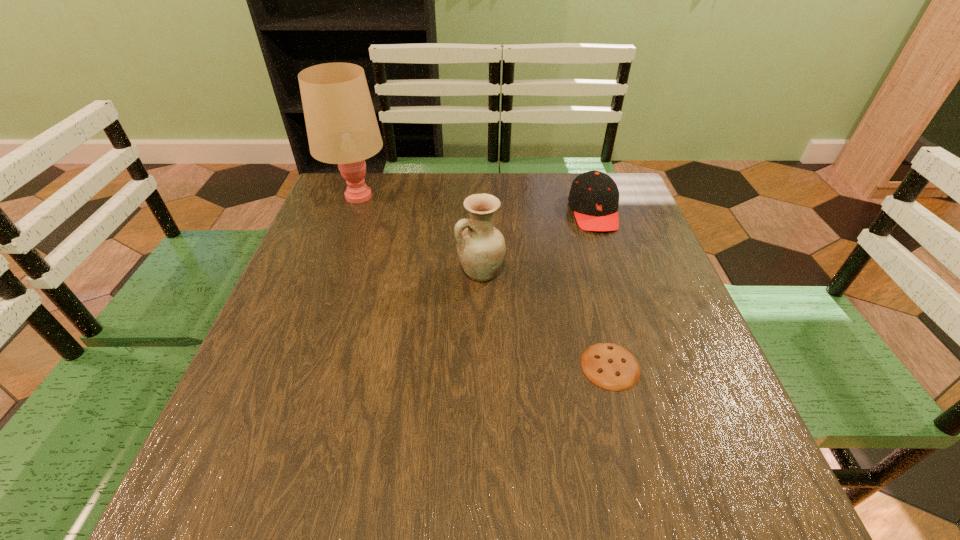
Locate which object ranks second in proximity to the lampshade. Please provide its 2D coordinates. Your answer should be formatted as a tuple, i.e. [(x, y)], where the tuple contains the x and y coordinates of a point satisfying the conditions above.

[(594, 196)]

The image size is (960, 540). In order to click on the closest object relative to the cap in this screenshot , I will do `click(481, 247)`.

Identify the location of free spot that satisfies the following two spatial constraints: 1. on the front side of the lampshade; 2. on the left side of the nearest object. (296, 366).